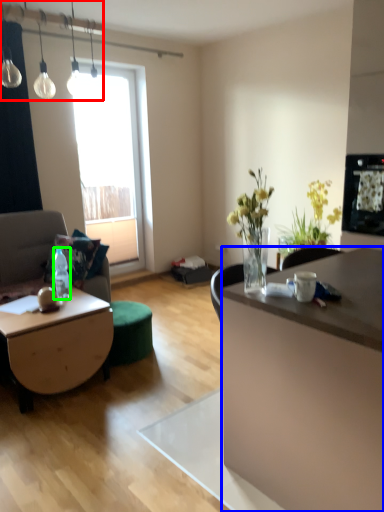
Question: Which object is the closest to the lamp (highlighted by a red box)? Choose among these: desk (highlighted by a blue box) or bottle (highlighted by a green box).

Choices:
 (A) desk
 (B) bottle

Answer: (B)